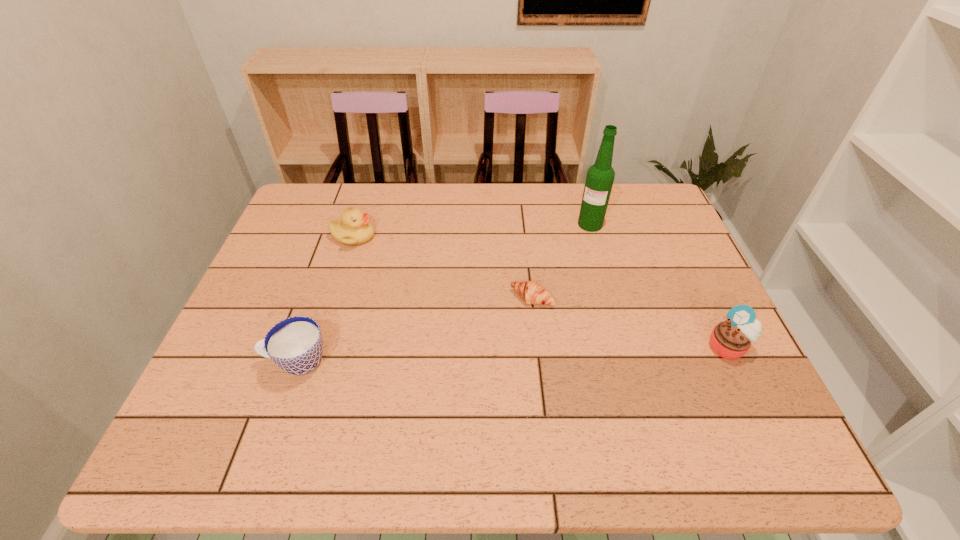
Where is `vacant area at the left edge`? Image resolution: width=960 pixels, height=540 pixels. vacant area at the left edge is located at coordinates (303, 299).

The height and width of the screenshot is (540, 960). In order to click on free space at the right edge in this screenshot , I will do `click(650, 291)`.

Identify the location of vacant space at the far left corner of the desktop. (330, 211).

I want to click on vacant area at the far right corner, so click(623, 202).

Where is `free space at the near right corner`? free space at the near right corner is located at coordinates point(720,401).

Identify the location of free space between the cup and the muffin. The width and height of the screenshot is (960, 540). (512, 355).

In order to click on free spot between the cup and the muffin in this screenshot , I will do `click(512, 355)`.

Image resolution: width=960 pixels, height=540 pixels. Find the location of `empty space between the cup and the fourth object from left to right`. empty space between the cup and the fourth object from left to right is located at coordinates (444, 293).

At what (x,y) coordinates should I click in order to perform the action: click on free space between the cup and the duckling. Please return your answer as a coordinate pair (x, y). The height and width of the screenshot is (540, 960). Looking at the image, I should click on (324, 299).

Where is `free point between the duckling and the beer bottle`? The image size is (960, 540). free point between the duckling and the beer bottle is located at coordinates (471, 231).